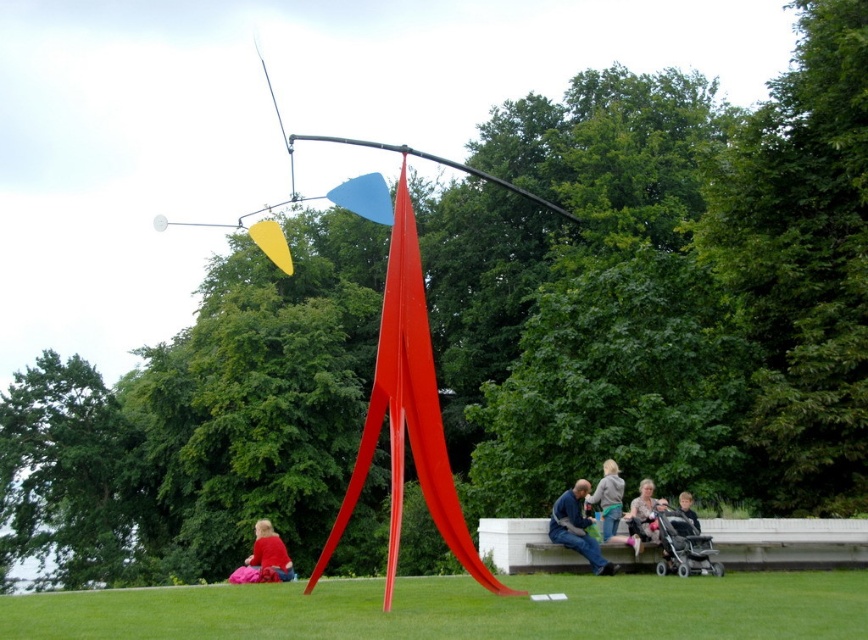
Question: Which object is farther from the camera taking this photo?

Choices:
 (A) gray sweater at center
 (B) blue fabric jacket at center
 (C) green grass at center
 (D) matte pink sweater at lower center

Answer: (A)

Question: Which object is positioned closest to the matte pink sweater at lower center?

Choices:
 (A) red fabric at lower left
 (B) blue fabric jacket at center
 (C) green grass at center

Answer: (B)

Question: Does blue fabric jacket at center have a lesser width compared to red fabric at lower left?

Choices:
 (A) no
 (B) yes

Answer: (B)

Question: Which of the following is the farthest from the observer?

Choices:
 (A) gray sweater at center
 (B) green grass at center
 (C) matte pink sweater at lower center

Answer: (A)

Question: Is blue fabric jacket at center bigger than red fabric at lower left?

Choices:
 (A) yes
 (B) no

Answer: (B)

Question: Is blue fabric jacket at center smaller than red fabric at lower left?

Choices:
 (A) yes
 (B) no

Answer: (A)